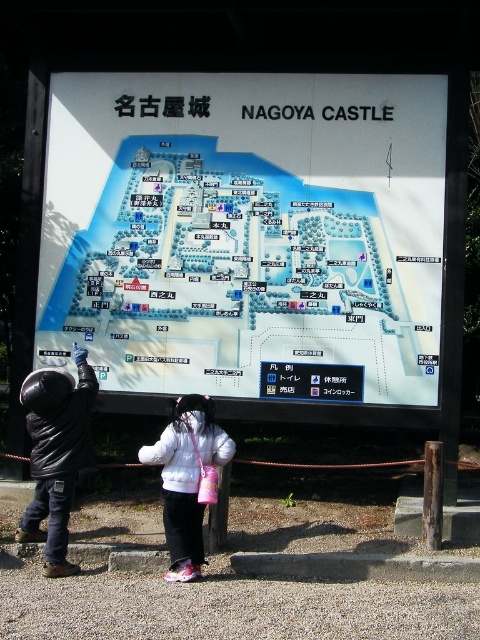
Question: Can you confirm if white fluffy jacket at center is smaller than white plastic sign at center?

Choices:
 (A) yes
 (B) no

Answer: (B)

Question: Based on their relative distances, which object is farther from the white paper map at center?

Choices:
 (A) black matte jacket at lower left
 (B) white fluffy jacket at center

Answer: (B)

Question: Does white paper map at center have a smaller size compared to black matte jacket at lower left?

Choices:
 (A) yes
 (B) no

Answer: (B)

Question: Does white paper map at center appear under white plastic sign at center?

Choices:
 (A) yes
 (B) no

Answer: (B)

Question: Which object is the closest to the white plastic sign at center?

Choices:
 (A) black matte jacket at lower left
 (B) white fluffy jacket at center

Answer: (B)

Question: Which of the following is the closest to the observer?

Choices:
 (A) black matte jacket at lower left
 (B) white paper map at center
 (C) white plastic sign at center

Answer: (A)